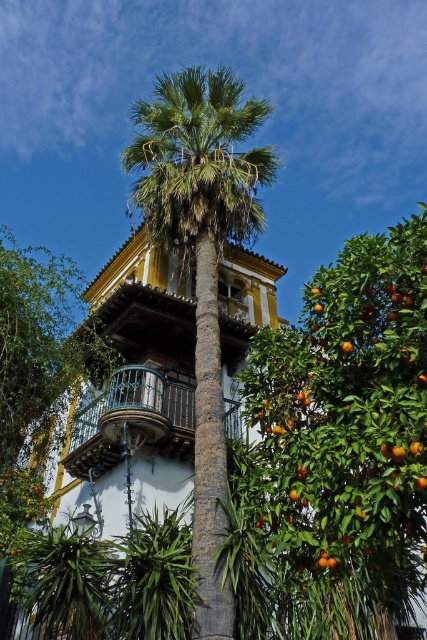
Who is shorter, orange matte/leathery fruit tree at upper right or black wrought iron balcony at center?

black wrought iron balcony at center

Between orange matte/leathery fruit tree at upper right and black wrought iron balcony at center, which one is positioned lower?

Positioned lower is black wrought iron balcony at center.

Between point (333, 452) and point (186, 387), which one is positioned behind?

Point (186, 387)

The height and width of the screenshot is (640, 427). What are the coordinates of `orange matte/leathery fruit tree at upper right` in the screenshot? It's located at (345, 440).

Is green leafy palm at center thinner than black wrought iron balcony at center?

No, green leafy palm at center is not thinner than black wrought iron balcony at center.

Does green leafy palm at center have a smaller size compared to black wrought iron balcony at center?

No, green leafy palm at center is not smaller than black wrought iron balcony at center.

Measure the distance between green leafy palm at center and camera.

green leafy palm at center is 10.45 meters away from camera.

Locate an element on the screen. green leafy palm at center is located at coordinates (201, 266).

Between point (345, 422) and point (198, 266), which one is positioned behind?

The point (198, 266) is behind.

At what (x,y) coordinates should I click in order to perform the action: click on orange matte/leathery fruit tree at upper right. Please return your answer as a coordinate pair (x, y). Image resolution: width=427 pixels, height=640 pixels. Looking at the image, I should click on (345, 440).

What are the coordinates of `orange matte/leathery fruit tree at upper right` in the screenshot? It's located at (345, 440).